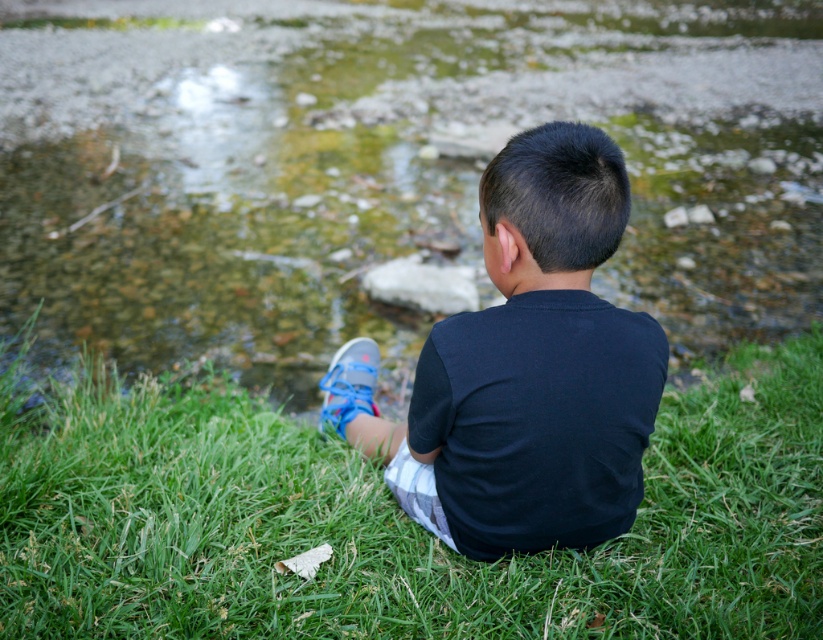
Question: Is green grass at lower center smaller than black cotton shirt at center?

Choices:
 (A) yes
 (B) no

Answer: (B)

Question: Which point appears closest to the camera in this image?

Choices:
 (A) (340, 372)
 (B) (40, 541)

Answer: (B)

Question: Which of the following is the closest to the observer?

Choices:
 (A) (608, 163)
 (B) (354, 413)

Answer: (A)

Question: Can you confirm if green grass at lower center is bigger than blue mesh shoe at lower center?

Choices:
 (A) no
 (B) yes

Answer: (B)

Question: Which of the following is the farthest from the observer?

Choices:
 (A) blue mesh shoe at lower center
 (B) black cotton shirt at center
 (C) green mossy river at center
 (D) green grass at lower center

Answer: (C)

Question: Can you confirm if black cotton shirt at center is positioned to the right of blue mesh shoe at lower center?

Choices:
 (A) no
 (B) yes

Answer: (B)